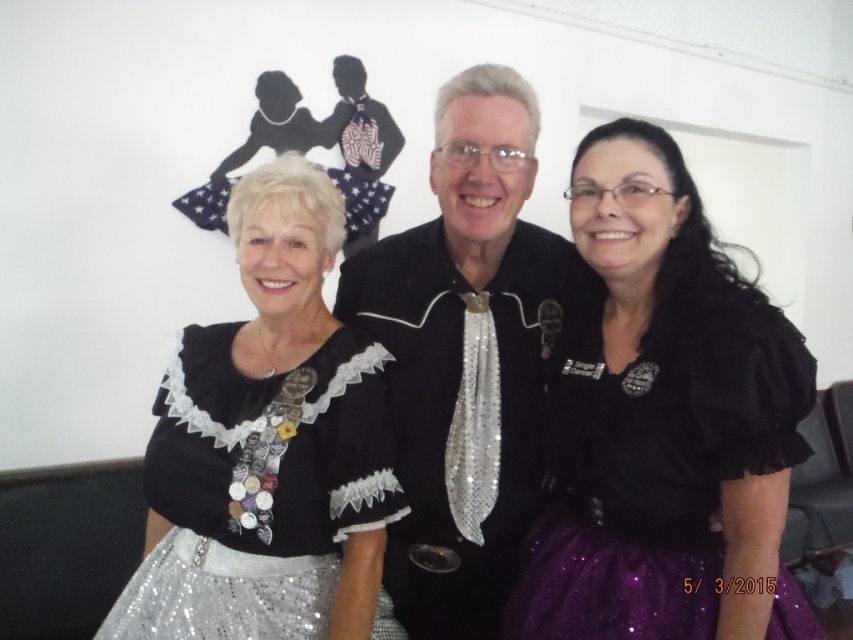
You are a photographer standing 1.5 meters away from the black sequined jacket at center. Can you reach out and touch the jacket without moving your position?

The black sequined jacket at center is 1.21 meters away from the viewer. Since you are standing 1.5 meters away from it, you cannot reach out and touch the jacket without moving closer.

You are standing at the origin of the coordinate system in the image. You see two points, point (x=624, y=365) and point (x=323, y=563). Which point is closer to you?

Point (x=624, y=365) is in front of point (x=323, y=563), so it is closer to you.